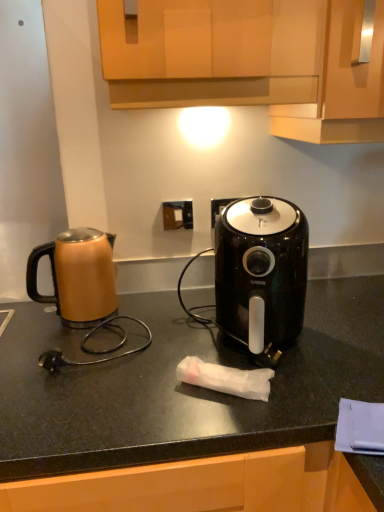
At what (x,y) coordinates should I click in order to perform the action: click on blank space situated above black matte countertop at center (from a real-world perspective). Please return your answer as a coordinate pair (x, y). Looking at the image, I should click on (178, 351).